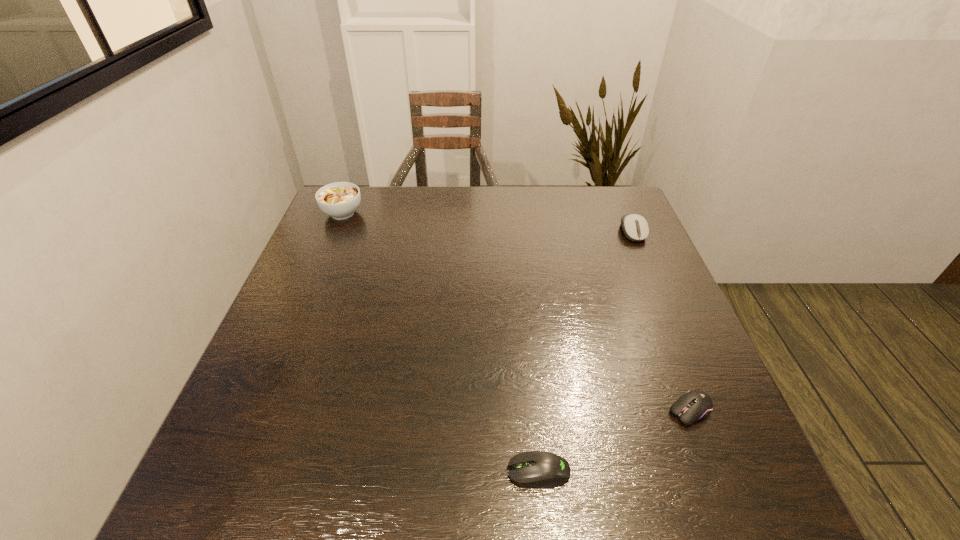
Locate an element on the screen. vacant space that satisfies the following two spatial constraints: 1. on the wheel side of the third shortest object; 2. on the wheel side of the leftmost computer mouse is located at coordinates (736, 471).